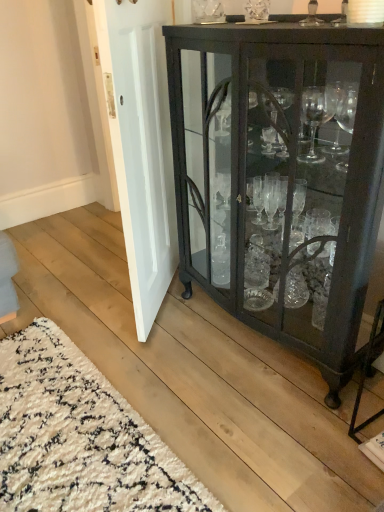
Identify the location of vacant space in front of matte black cabinet at right. 264,425.